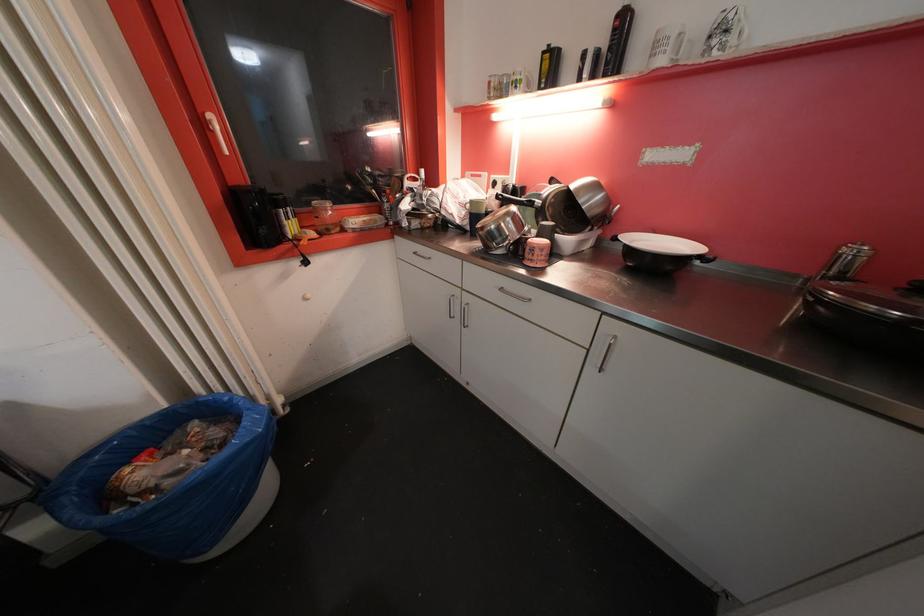
Which object does [683,46] point to?

It corresponds to the white patterned mug in the image.